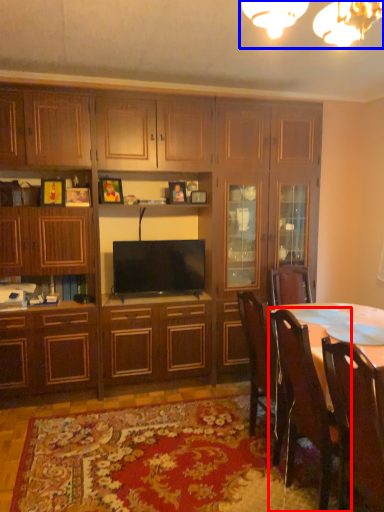
Question: Which point is further to the camera, chair (highlighted by a red box) or light fixture (highlighted by a blue box)?

Choices:
 (A) chair
 (B) light fixture

Answer: (A)